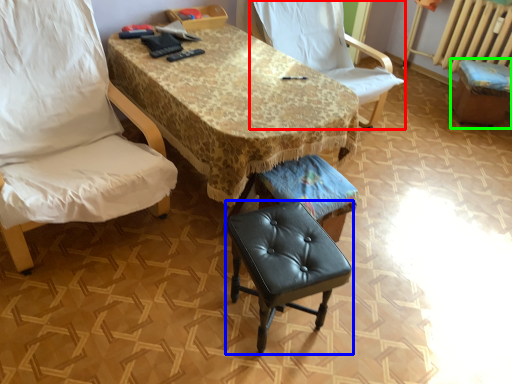
Question: Based on their relative distances, which object is farther from chair (highlighted by a red box)? Choose from stool (highlighted by a blue box) and bar stool (highlighted by a green box).

Choices:
 (A) stool
 (B) bar stool

Answer: (A)